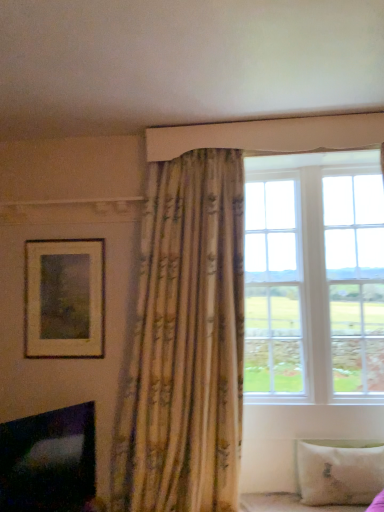
Question: Based on their positions, is white wood window at upper right located to the left or right of white fabric bed frame at lower right?

Choices:
 (A) left
 (B) right

Answer: (B)

Question: From a real-world perspective, is white wood window at upper right above or below white fabric bed frame at lower right?

Choices:
 (A) above
 (B) below

Answer: (A)

Question: Estimate the real-world distances between objects in this image. Which object is closer to the black glossy fireplace at lower left?

Choices:
 (A) white fabric bed frame at lower right
 (B) matte gold picture frame at upper left
 (C) white soft pillow at lower right
 (D) textured beige curtain at center
 (E) white wood window at upper right

Answer: (D)

Question: Which object is positioned farthest from the white soft pillow at lower right?

Choices:
 (A) black glossy fireplace at lower left
 (B) white wood window at upper right
 (C) matte gold picture frame at upper left
 (D) textured beige curtain at center
 (E) white fabric bed frame at lower right

Answer: (C)